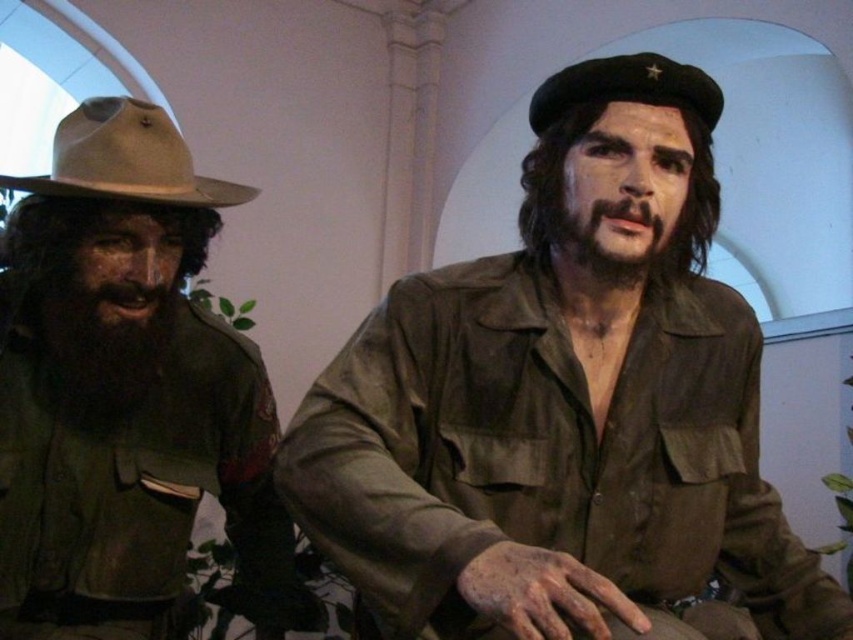
Question: Does matte brown uniform at center have a greater width compared to dark brown fuzzy beard at left?

Choices:
 (A) yes
 (B) no

Answer: (A)

Question: Which of the following is the farthest from the observer?

Choices:
 (A) black felt beret at upper center
 (B) dark brown hair at center
 (C) tan felt cowboy hat at left

Answer: (C)

Question: Which of the following is the closest to the observer?

Choices:
 (A) matte brown uniform at center
 (B) dark brown hair at center

Answer: (A)

Question: Is dark brown fuzzy beard at left positioned at the back of black felt beret at upper center?

Choices:
 (A) no
 (B) yes

Answer: (B)

Question: Based on their relative distances, which object is nearer to the dark brown fuzzy beard at left?

Choices:
 (A) tan felt cowboy hat at left
 (B) dark brown hair at center

Answer: (A)

Question: Is matte brown uniform at center behind dark brown fuzzy beard at left?

Choices:
 (A) yes
 (B) no

Answer: (B)